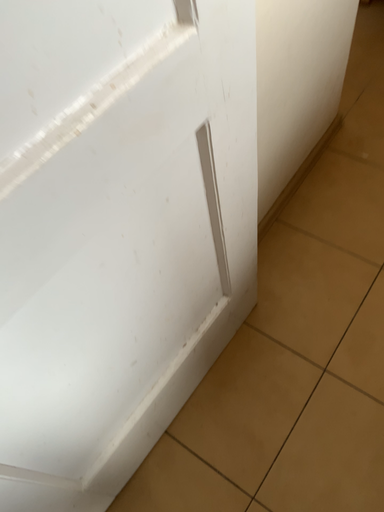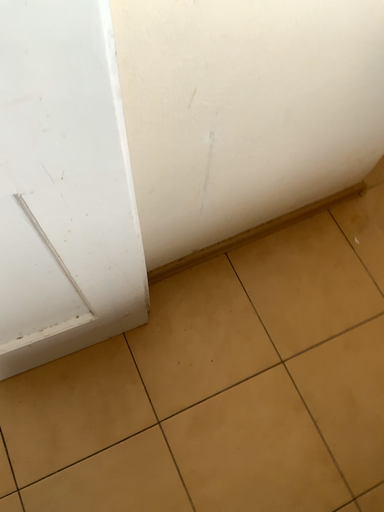
Question: How did the camera likely rotate when shooting the video?

Choices:
 (A) rotated downward
 (B) rotated upward

Answer: (A)